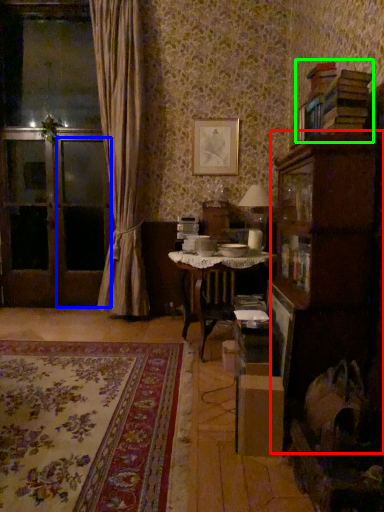
Question: Based on their relative distances, which object is farther from cabinetry (highlighted by a red box)? Choose from screen door (highlighted by a blue box) and book (highlighted by a green box).

Choices:
 (A) screen door
 (B) book

Answer: (A)